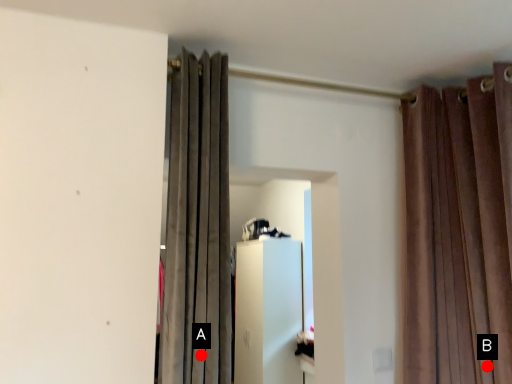
Question: Two points are circled on the image, labeled by A and B beside each circle. Among these points, which one is nearest to the camera?

Choices:
 (A) A is closer
 (B) B is closer

Answer: (A)